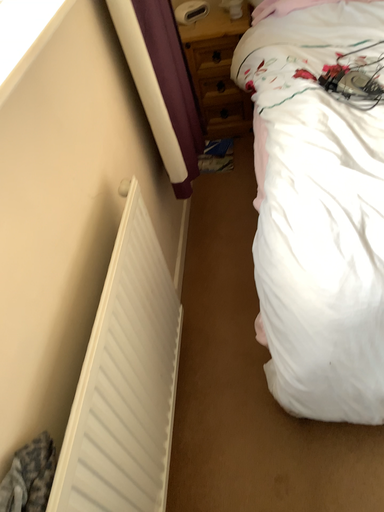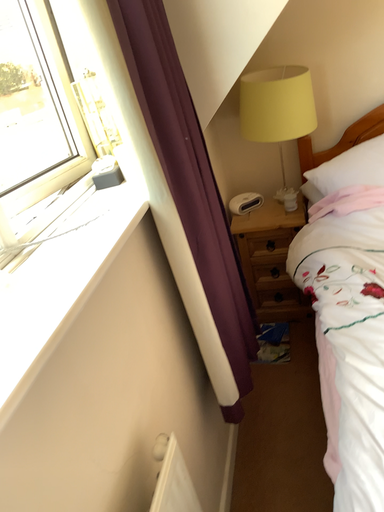
Question: How did the camera likely rotate when shooting the video?

Choices:
 (A) rotated left
 (B) rotated right

Answer: (A)